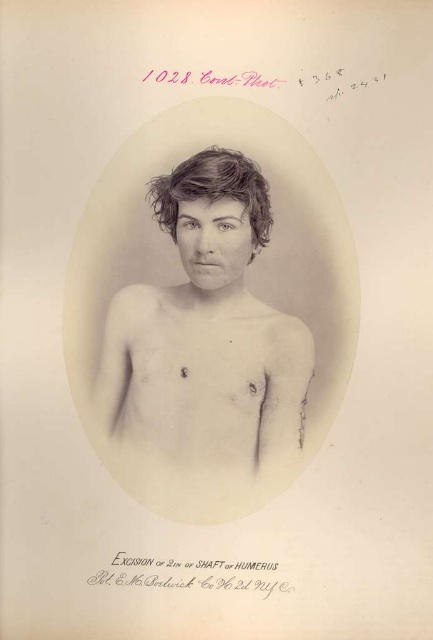
Based on the provided image, which object is wider between the smooth skin torso at center and the dark brown wavy hair at center?

The smooth skin torso at center is wider than the dark brown wavy hair at center according to the description.

You are a medical student analyzing this historical photograph. You notice the smooth skin torso at center and the dark brown wavy hair at center. Which object is positioned closer to the viewer?

The smooth skin torso at center is closer to the viewer because the dark brown wavy hair at center is behind it.